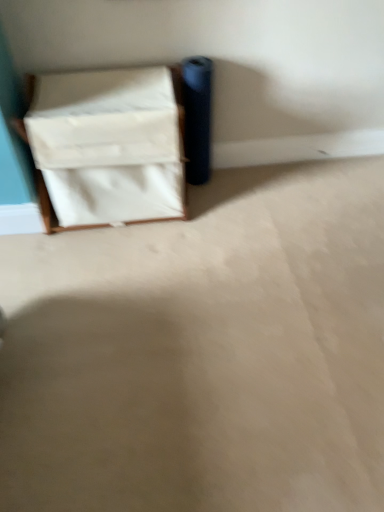
The width and height of the screenshot is (384, 512). What do you see at coordinates (108, 146) in the screenshot?
I see `white fabric laundry basket at left` at bounding box center [108, 146].

At what (x,y) coordinates should I click in order to perform the action: click on white fabric laundry basket at left. Please return your answer as a coordinate pair (x, y). Looking at the image, I should click on (108, 146).

Measure the distance between point (138, 76) and camera.

Point (138, 76) and camera are 1.84 meters apart.

Identify the location of white fabric laundry basket at left. The width and height of the screenshot is (384, 512). (108, 146).